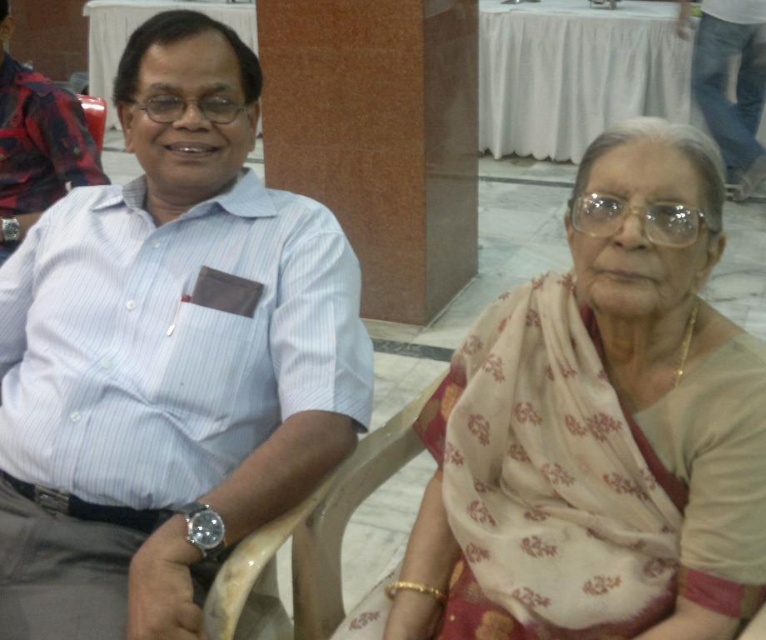
Question: Can you confirm if white striped shirt at left is positioned to the right of matte white shirt at center?

Choices:
 (A) yes
 (B) no

Answer: (B)

Question: Does white striped shirt at left have a lesser width compared to matte white shirt at center?

Choices:
 (A) no
 (B) yes

Answer: (A)

Question: Based on their relative distances, which object is farther from the white striped shirt at left?

Choices:
 (A) wooden at center
 (B) matte white shirt at left
 (C) matte white shirt at center
 (D) beige floral saree at center

Answer: (C)

Question: Does beige floral saree at center appear under matte white shirt at left?

Choices:
 (A) yes
 (B) no

Answer: (A)

Question: Which object is the farthest from the beige floral saree at center?

Choices:
 (A) white striped shirt at left
 (B) wooden at center
 (C) matte white shirt at center
 (D) matte white shirt at left

Answer: (C)

Question: Based on their relative distances, which object is nearer to the matte white shirt at left?

Choices:
 (A) wooden at center
 (B) white striped shirt at left
 (C) matte white shirt at center
 (D) beige floral saree at center

Answer: (B)